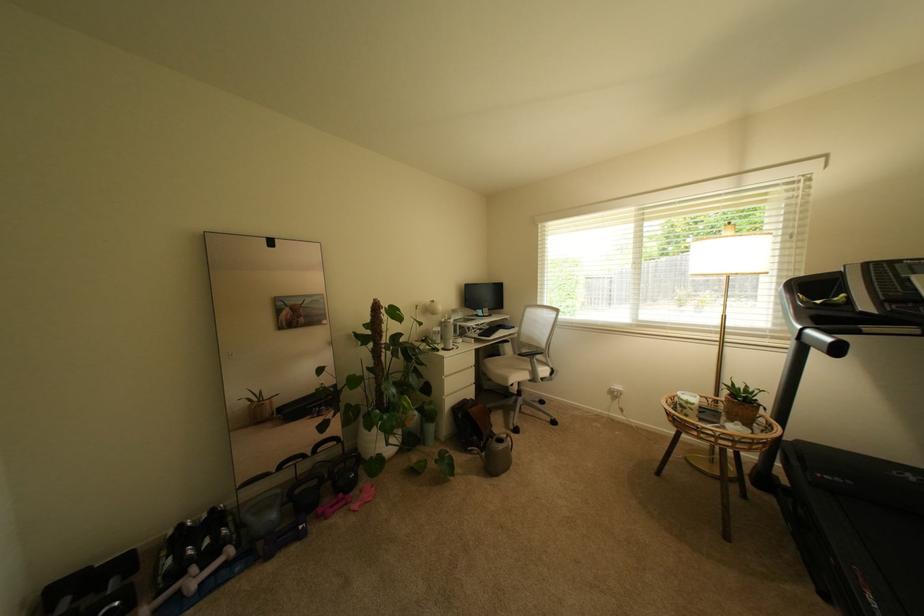
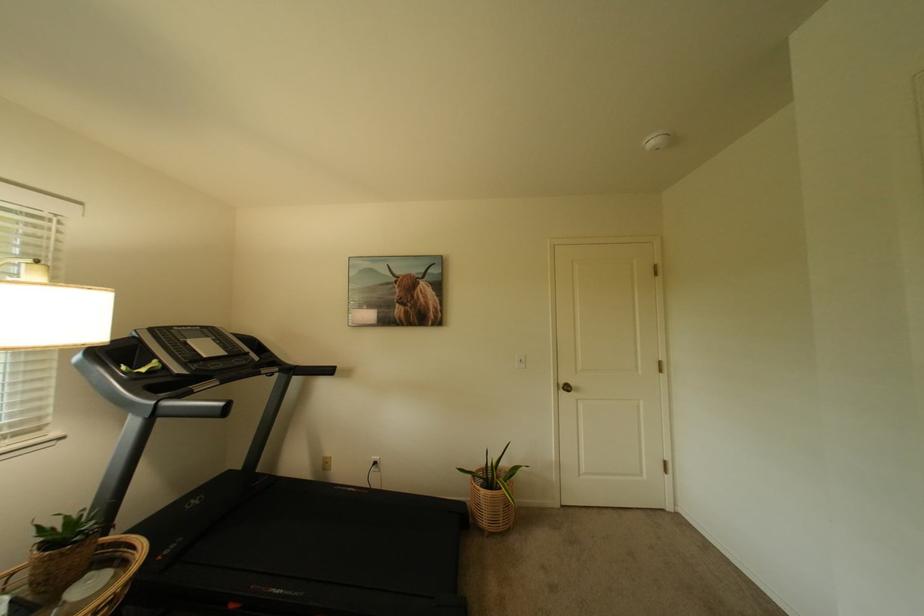
The point at [873,333] is marked in the first image. Where is the corresponding point in the second image?

(203, 392)